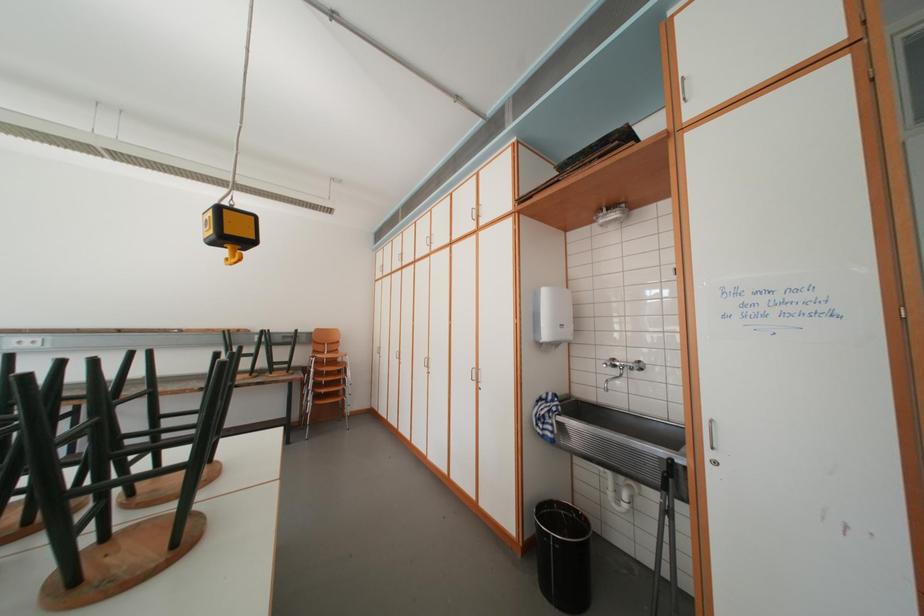
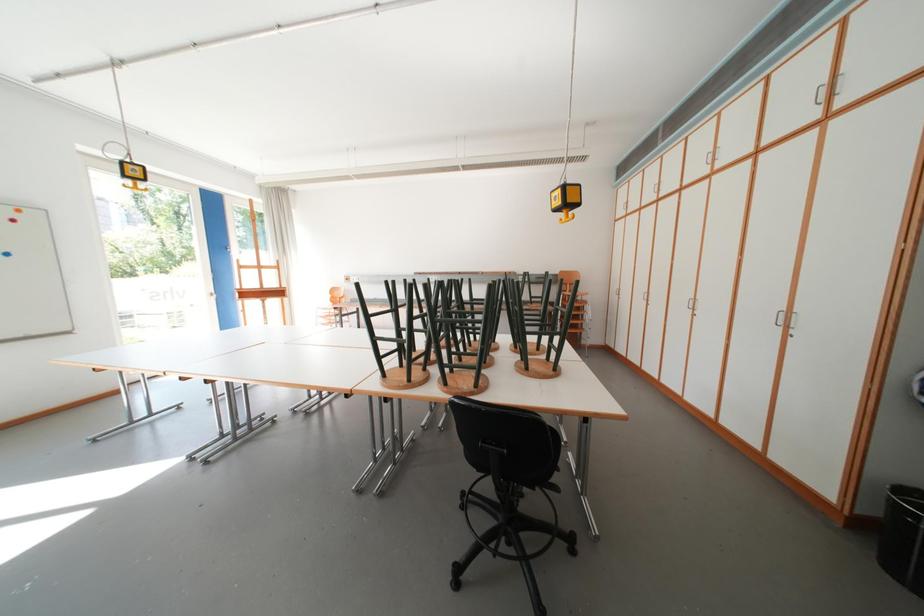
Question: The first image is from the beginning of the video and the second image is from the end. How did the camera likely rotate when shooting the video?

Choices:
 (A) Left
 (B) Right
 (C) Up
 (D) Down

Answer: (A)